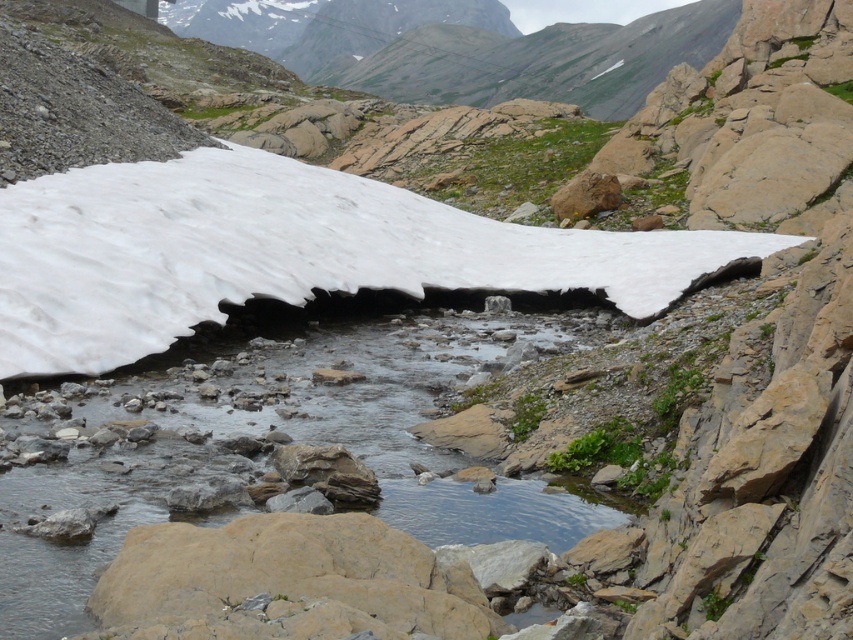
Question: Does white matte snow at upper center come in front of clear water at center?

Choices:
 (A) yes
 (B) no

Answer: (B)

Question: Can you confirm if white matte snow at upper center is bigger than clear water at center?

Choices:
 (A) no
 (B) yes

Answer: (B)

Question: Does white matte snow at upper center come in front of clear water at center?

Choices:
 (A) no
 (B) yes

Answer: (A)

Question: Which of the following is the closest to the observer?

Choices:
 (A) clear water at center
 (B) white matte snow at upper center

Answer: (A)

Question: Which point is farther to the camera?

Choices:
 (A) white matte snow at upper center
 (B) clear water at center

Answer: (A)